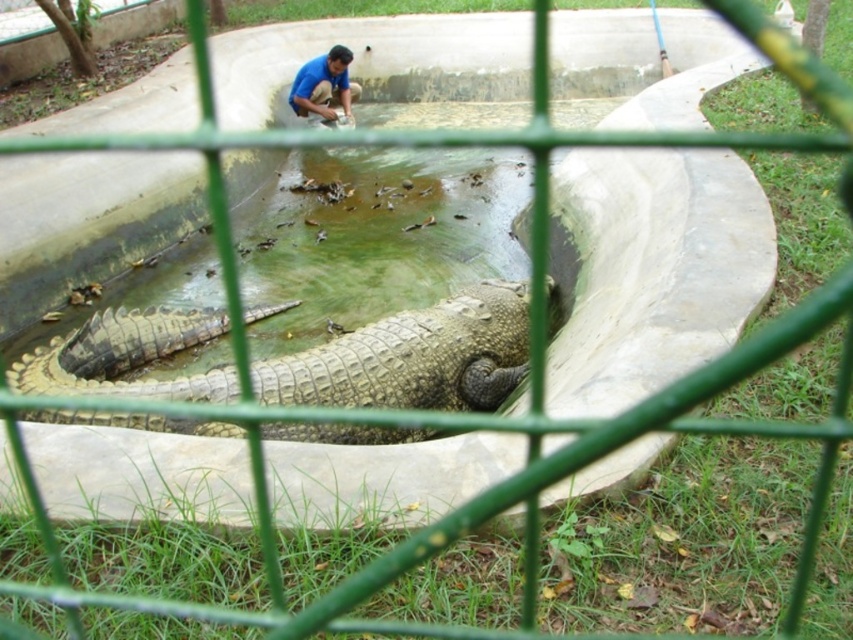
You are taking a photo of the crocodiles in the zoo and want to focus on both point (97, 376) and point (302, 88). Which point should you focus on first to ensure both are in sharp focus?

You should focus on point (97, 376) first since it is closer to the camera, ensuring both points will be in focus when using depth of field appropriately.

In the scene shown: You are a zookeeper standing at the edge of the pool. You need to place a new feeding tray for the leathery brown crocodile at center. Where should you place it relative to the crocodile?

The feeding tray should be placed near the leathery brown crocodile at center at point coordinates approximately 0.559 on the x axis and 0.485 on the y axis.

You are a zookeeper who needs to feed the leathery brown crocodile at center. You are standing 2 meters away from the edge of the pool. The safety guidelines state that you must stay at least 4 meters away from any crocodile. Is it safe for you to proceed with feeding the crocodile?

The leathery brown crocodile at center is 3.95 meters away from the camera. Since you are standing 2 meters away from the edge of the pool, your total distance from the crocodile would be less than 4 meters, violating the safety guidelines. Therefore, it is not safe to proceed with feeding the crocodile.